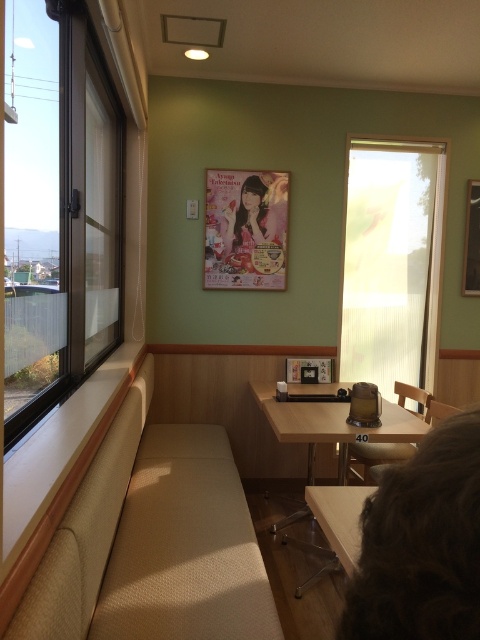
What do you see at coordinates (250, 218) in the screenshot?
I see `matte pink poster at center` at bounding box center [250, 218].

In the scene shown: Can you confirm if matte pink poster at center is positioned to the right of wooden chair at center?

In fact, matte pink poster at center is to the left of wooden chair at center.

This screenshot has height=640, width=480. What are the coordinates of `matte pink poster at center` in the screenshot? It's located at (250, 218).

Consider the image. Who is more forward, (428, 307) or (308, 422)?

Positioned in front is point (308, 422).

Locate an element on the screen. translucent glass window at center is located at coordinates (392, 260).

Who is lower down, transparent glass window at left or matte paper poster at center?

Positioned lower is transparent glass window at left.

Between transparent glass window at left and matte paper poster at center, which one has less height?

matte paper poster at center is shorter.

Locate an element on the screen. The image size is (480, 640). transparent glass window at left is located at coordinates (66, 230).

This screenshot has height=640, width=480. Identify the location of transparent glass window at left. (66, 230).